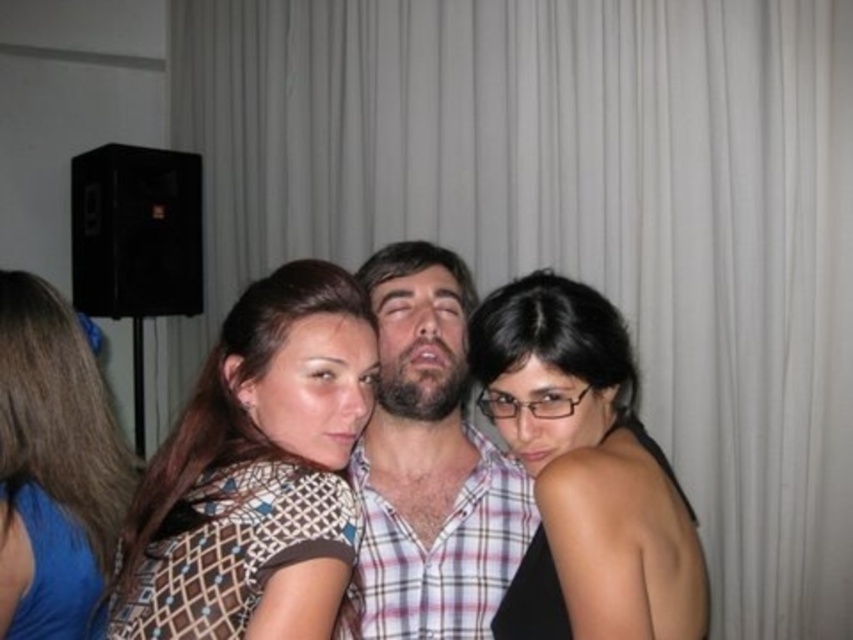
Question: Which of these objects is positioned farthest from the matte brown dress at left?

Choices:
 (A) black matte hair at center
 (B) patterned fabric shirt at center
 (C) plaid fabric shirt at center

Answer: (A)

Question: Which point appears farthest from the camera in this image?

Choices:
 (A) [x=442, y=595]
 (B) [x=621, y=426]
 (C) [x=202, y=636]
 (D) [x=45, y=371]

Answer: (D)

Question: Which object is farther from the camera taking this photo?

Choices:
 (A) patterned fabric shirt at center
 (B) matte brown dress at left

Answer: (B)

Question: Observing the image, what is the correct spatial positioning of black matte hair at center in reference to plaid fabric shirt at center?

Choices:
 (A) below
 (B) above

Answer: (A)

Question: Does plaid fabric shirt at center appear over matte brown dress at left?

Choices:
 (A) yes
 (B) no

Answer: (A)

Question: Is black matte hair at center bigger than plaid fabric shirt at center?

Choices:
 (A) no
 (B) yes

Answer: (A)